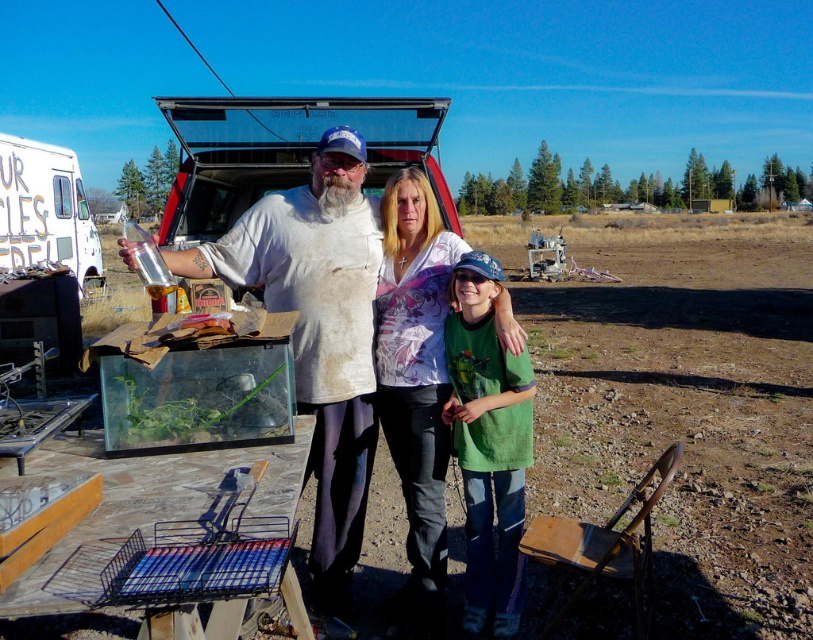
Can you confirm if matte white blouse at center is positioned to the right of green cotton shirt at center?

In fact, matte white blouse at center is to the left of green cotton shirt at center.

Can you confirm if matte white blouse at center is bigger than green cotton shirt at center?

No.

Where is `matte white blouse at center`? matte white blouse at center is located at coordinates pos(415,374).

Identify the location of matte white blouse at center. (415, 374).

Who is positioned more to the right, worn white shirt at center or matte white blouse at center?

Positioned to the right is matte white blouse at center.

Does worn white shirt at center appear under matte white blouse at center?

Actually, worn white shirt at center is above matte white blouse at center.

Which is behind, point (259, 257) or point (512, 332)?

Positioned behind is point (259, 257).

Image resolution: width=813 pixels, height=640 pixels. Identify the location of worn white shirt at center. (318, 332).

Does worn white shirt at center have a smaller size compared to green cotton shirt at center?

No, worn white shirt at center is not smaller than green cotton shirt at center.

Between point (202, 257) and point (462, 481), which one is positioned in front?

Point (202, 257)

You are a GUI agent. You are given a task and a screenshot of the screen. Output one action in this format:
    pyautogui.click(x=<x>, y=<y>)
    Task: Click on the worn white shirt at center
    
    Given the screenshot: What is the action you would take?
    pyautogui.click(x=318, y=332)